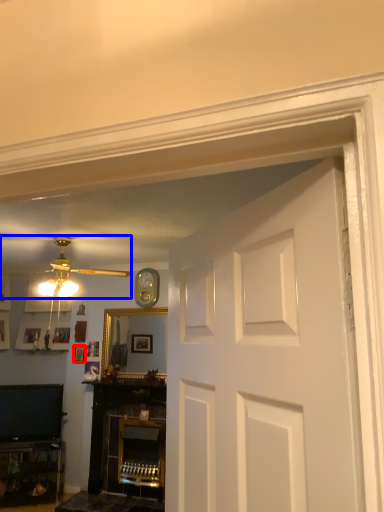
Question: Among these objects, which one is nearest to the camera, picture frame (highlighted by a red box) or ceiling fan (highlighted by a blue box)?

Choices:
 (A) picture frame
 (B) ceiling fan

Answer: (B)